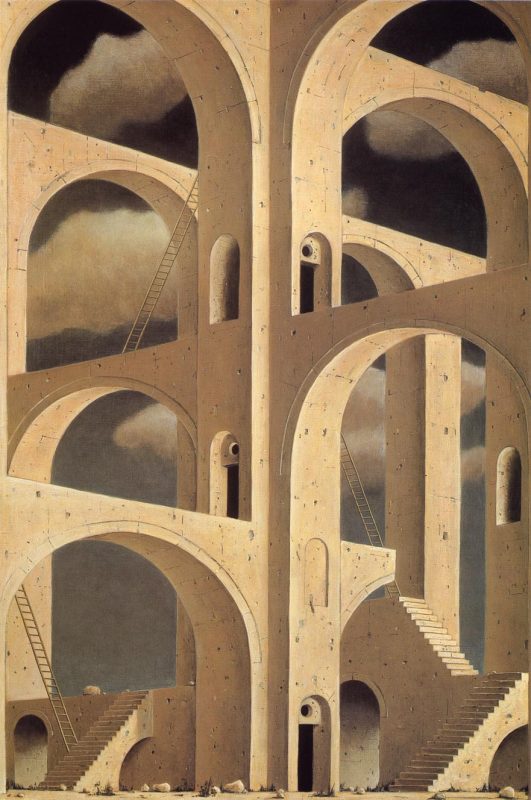
The height and width of the screenshot is (800, 531). What are the coordinates of `circular hole over doorway` in the screenshot? It's located at point(305,710).